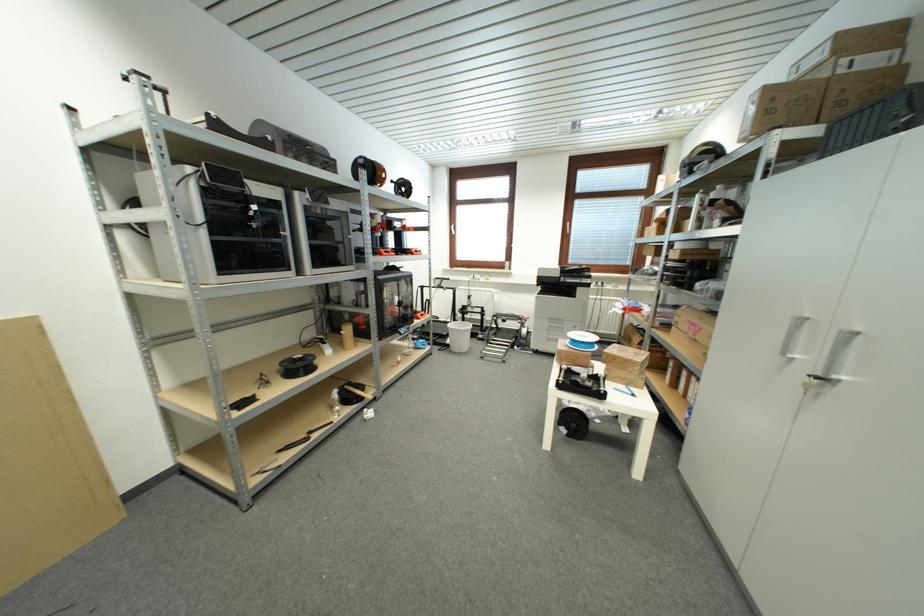
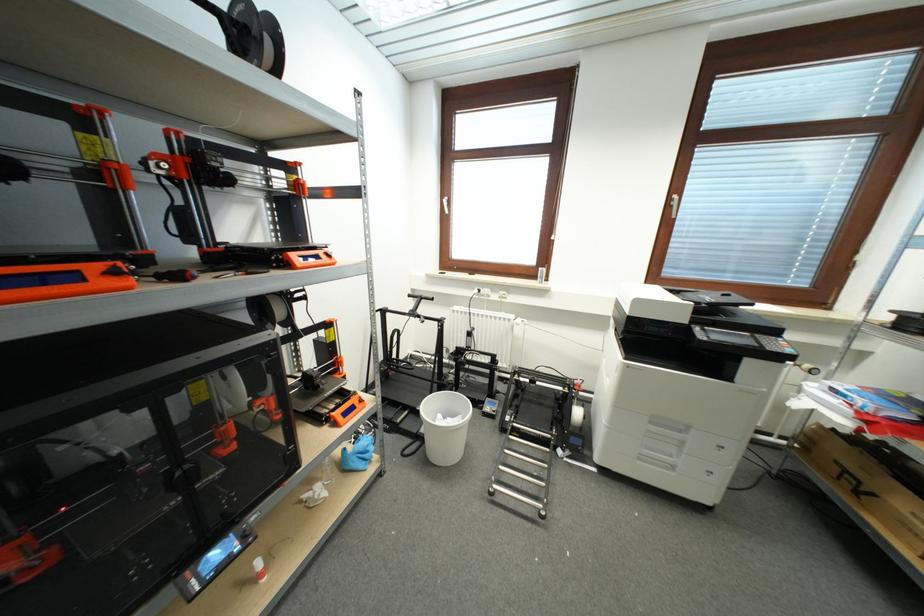
Where in the second image is the point corresponding to (555,326) from the first image?

(658, 431)